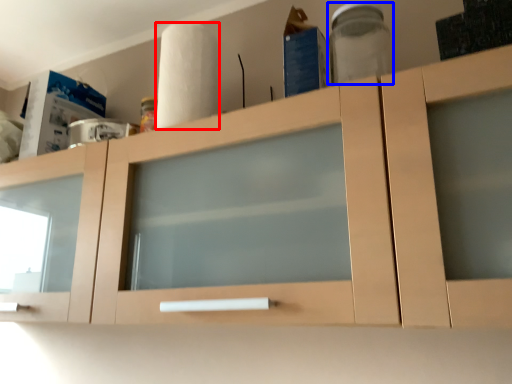
Question: Among these objects, which one is nearest to the camera, paper towel (highlighted by a red box) or glass jar (highlighted by a blue box)?

Choices:
 (A) paper towel
 (B) glass jar

Answer: (B)